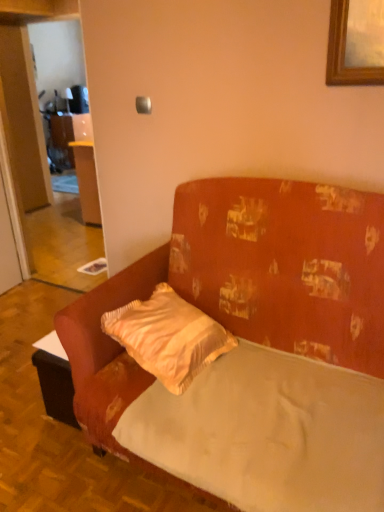
Question: Is velvet orange couch at center located within smooth white mattress at center?

Choices:
 (A) yes
 (B) no

Answer: (B)

Question: Can you confirm if smooth white mattress at center is wider than velvet orange couch at center?

Choices:
 (A) no
 (B) yes

Answer: (A)

Question: Does smooth white mattress at center have a smaller size compared to velvet orange couch at center?

Choices:
 (A) no
 (B) yes

Answer: (B)

Question: Considering the relative sizes of smooth white mattress at center and velvet orange couch at center in the image provided, is smooth white mattress at center taller than velvet orange couch at center?

Choices:
 (A) no
 (B) yes

Answer: (A)

Question: Is smooth white mattress at center completely or partially outside of velvet orange couch at center?

Choices:
 (A) yes
 (B) no

Answer: (B)

Question: Is smooth white mattress at center further to the viewer compared to velvet orange couch at center?

Choices:
 (A) yes
 (B) no

Answer: (A)

Question: Is velvet orange couch at center wider than smooth white mattress at center?

Choices:
 (A) no
 (B) yes

Answer: (B)

Question: Does velvet orange couch at center have a greater height compared to smooth white mattress at center?

Choices:
 (A) no
 (B) yes

Answer: (B)

Question: Is velvet orange couch at center next to smooth white mattress at center?

Choices:
 (A) no
 (B) yes

Answer: (A)

Question: Can you confirm if velvet orange couch at center is thinner than smooth white mattress at center?

Choices:
 (A) no
 (B) yes

Answer: (A)

Question: Is velvet orange couch at center aimed at smooth white mattress at center?

Choices:
 (A) no
 (B) yes

Answer: (B)

Question: Considering the relative positions of velvet orange couch at center and smooth white mattress at center in the image provided, is velvet orange couch at center to the right of smooth white mattress at center from the viewer's perspective?

Choices:
 (A) no
 (B) yes

Answer: (A)

Question: Is velvet orange couch at center not near satin yellow pillow at center?

Choices:
 (A) yes
 (B) no

Answer: (B)